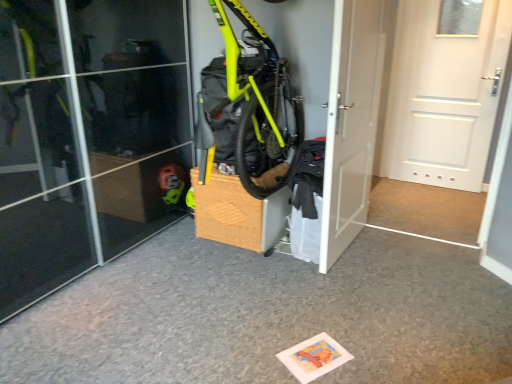
Question: Based on their positions, is white matte door at right, which is the second door from left to right, located to the left or right of white matte door at center, arranged as the 2th door when viewed from the right?

Choices:
 (A) left
 (B) right

Answer: (B)

Question: In terms of width, does white matte door at right, the 1th door when ordered from right to left, look wider or thinner when compared to white matte door at center, the first door when ordered from left to right?

Choices:
 (A) thin
 (B) wide

Answer: (B)

Question: Which is correct: white matte door at right, which is the second door from left to right, is inside white matte door at center, the first door when ordered from left to right, or outside of it?

Choices:
 (A) outside
 (B) inside

Answer: (A)

Question: Considering the positions of white matte door at center, arranged as the 2th door when viewed from the right, and white matte door at right, the 1th door when ordered from right to left, in the image, is white matte door at center, arranged as the 2th door when viewed from the right, bigger or smaller than white matte door at right, the 1th door when ordered from right to left,?

Choices:
 (A) big
 (B) small

Answer: (B)

Question: From a real-world perspective, is white matte door at center, the first door when ordered from left to right, above or below white matte door at right, the 1th door when ordered from right to left?

Choices:
 (A) above
 (B) below

Answer: (B)

Question: Relative to white matte door at right, which is the second door from left to right, is white matte door at center, arranged as the 2th door when viewed from the right, in front or behind?

Choices:
 (A) front
 (B) behind

Answer: (A)

Question: Is white matte door at center, arranged as the 2th door when viewed from the right, taller or shorter than white matte door at right, the 1th door when ordered from right to left?

Choices:
 (A) tall
 (B) short

Answer: (A)